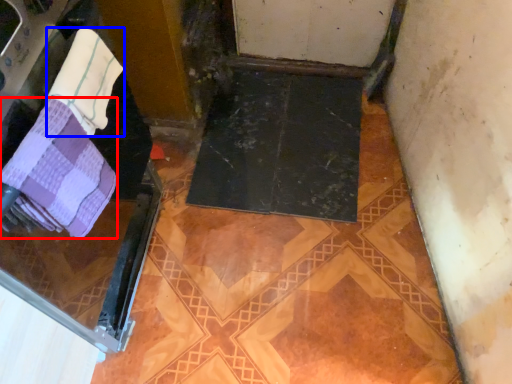
Question: Which point is closer to the camera, towel (highlighted by a red box) or towel (highlighted by a blue box)?

Choices:
 (A) towel
 (B) towel

Answer: (A)